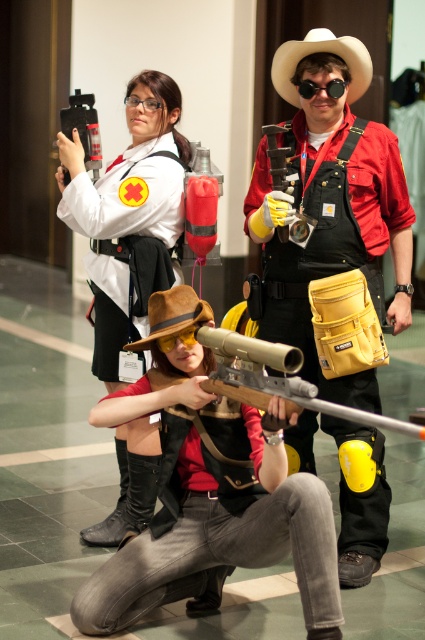
Who is more forward, (110, 180) or (277, 346)?

Point (277, 346) is more forward.

Who is lower down, matte white shirt at upper left or matte silver rifle at center?

matte silver rifle at center

Does point (141, 148) come in front of point (300, 353)?

No, (141, 148) is behind (300, 353).

This screenshot has width=425, height=640. Find the location of `matte white shirt at upper left`. matte white shirt at upper left is located at coordinates (130, 216).

Is matte white shirt at upper left shorter than brown felt cowboy hat at center?

No.

Is matte white shirt at upper left further to the viewer compared to brown felt cowboy hat at center?

Yes, matte white shirt at upper left is further from the viewer.

Is point (113, 193) closer to viewer compared to point (169, 294)?

No, (113, 193) is further to viewer.

Locate an element on the screen. The image size is (425, 640). matte white shirt at upper left is located at coordinates (130, 216).

Does matte silver rifle at center appear under black matte goggles at upper center?

Correct, matte silver rifle at center is located below black matte goggles at upper center.

Is point (240, 376) positioned after point (334, 97)?

No.

The width and height of the screenshot is (425, 640). Identify the location of matte silver rifle at center. (277, 378).